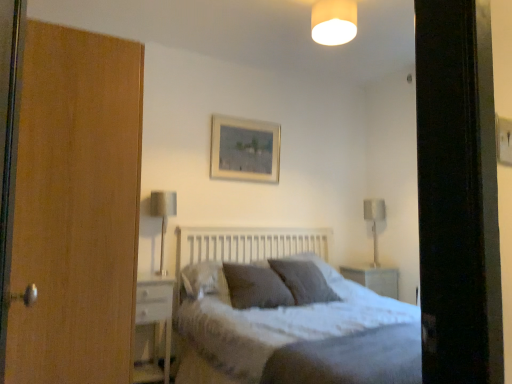
Question: Can you confirm if textured gray bed at center is positioned to the left of dark gray textured pillow at center, the first pillow from the back?

Choices:
 (A) yes
 (B) no

Answer: (B)

Question: Does textured gray bed at center have a greater width compared to dark gray textured pillow at center, the first pillow from the back?

Choices:
 (A) no
 (B) yes

Answer: (B)

Question: Considering the relative positions of textured gray bed at center and dark gray textured pillow at center, which appears as the third pillow when viewed from the front, in the image provided, is textured gray bed at center in front of dark gray textured pillow at center, which appears as the third pillow when viewed from the front,?

Choices:
 (A) yes
 (B) no

Answer: (A)

Question: From a real-world perspective, does textured gray bed at center stand above dark gray textured pillow at center, the first pillow from the back?

Choices:
 (A) no
 (B) yes

Answer: (A)

Question: Considering the relative sizes of textured gray bed at center and dark gray textured pillow at center, which appears as the third pillow when viewed from the front, in the image provided, is textured gray bed at center bigger than dark gray textured pillow at center, which appears as the third pillow when viewed from the front,?

Choices:
 (A) no
 (B) yes

Answer: (B)

Question: From a real-world perspective, is textured gray bed at center beneath dark gray textured pillow at center, which appears as the third pillow when viewed from the front?

Choices:
 (A) no
 (B) yes

Answer: (B)

Question: From the image's perspective, is textured gray pillow at center, the second pillow viewed from the back, above satin silver table lamp at left, acting as the second table lamp starting from the back?

Choices:
 (A) no
 (B) yes

Answer: (A)

Question: From a real-world perspective, is textured gray pillow at center, which is the 2th pillow in front-to-back order, positioned over satin silver table lamp at left, which is the 1th table lamp from front to back, based on gravity?

Choices:
 (A) no
 (B) yes

Answer: (A)

Question: Is textured gray pillow at center, the second pillow viewed from the back, closer to camera compared to satin silver table lamp at left, the first table lamp positioned from the left?

Choices:
 (A) yes
 (B) no

Answer: (A)

Question: Can you confirm if textured gray pillow at center, which is the 2th pillow in front-to-back order, is smaller than satin silver table lamp at left, which is the 1th table lamp from front to back?

Choices:
 (A) no
 (B) yes

Answer: (A)

Question: From a real-world perspective, does textured gray pillow at center, which is the 2th pillow in front-to-back order, sit lower than satin silver table lamp at left, acting as the second table lamp starting from the back?

Choices:
 (A) yes
 (B) no

Answer: (A)

Question: Is textured gray pillow at center, the second pillow viewed from the back, taller than satin silver table lamp at left, the first table lamp positioned from the left?

Choices:
 (A) yes
 (B) no

Answer: (B)

Question: Is textured gray pillow at center, the second pillow viewed from the back, completely or partially inside white glossy nightstand at lower left?

Choices:
 (A) yes
 (B) no

Answer: (B)